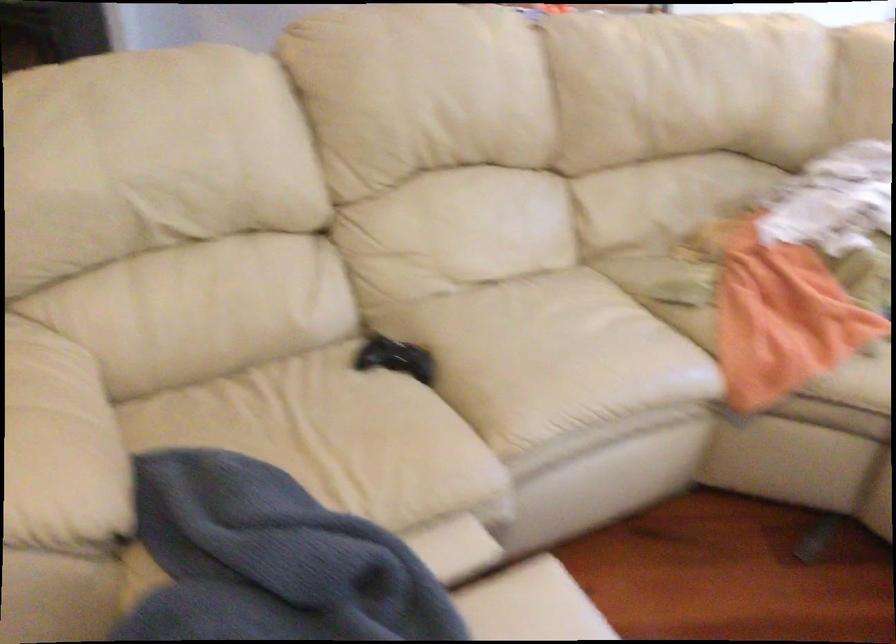
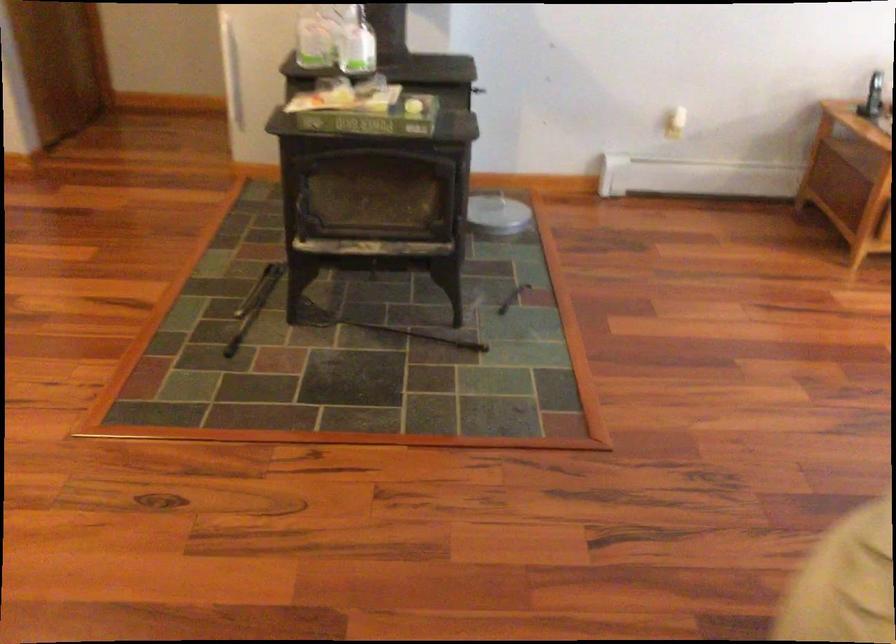
Which direction would the cameraman need to move to produce the second image?

The movement direction of the cameraman is left, forward.